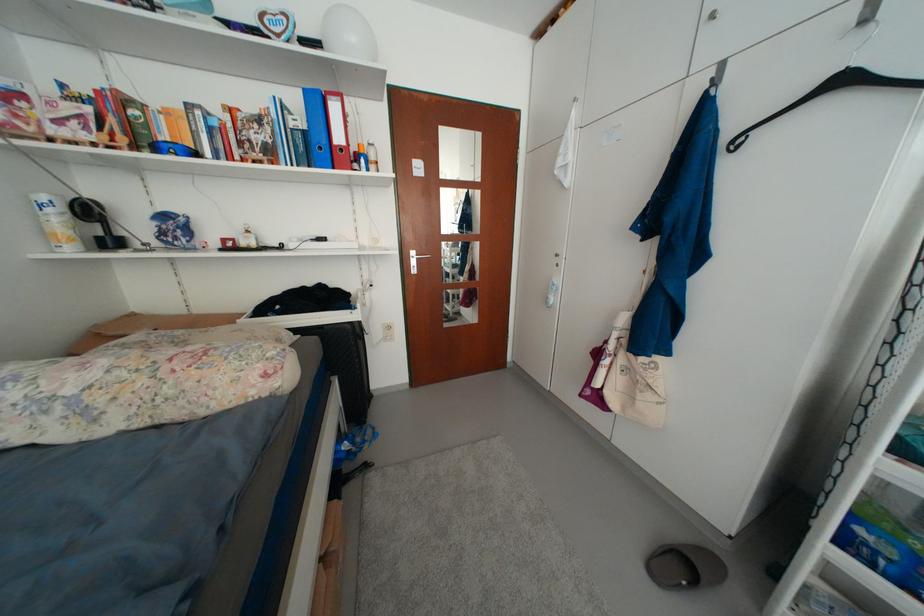
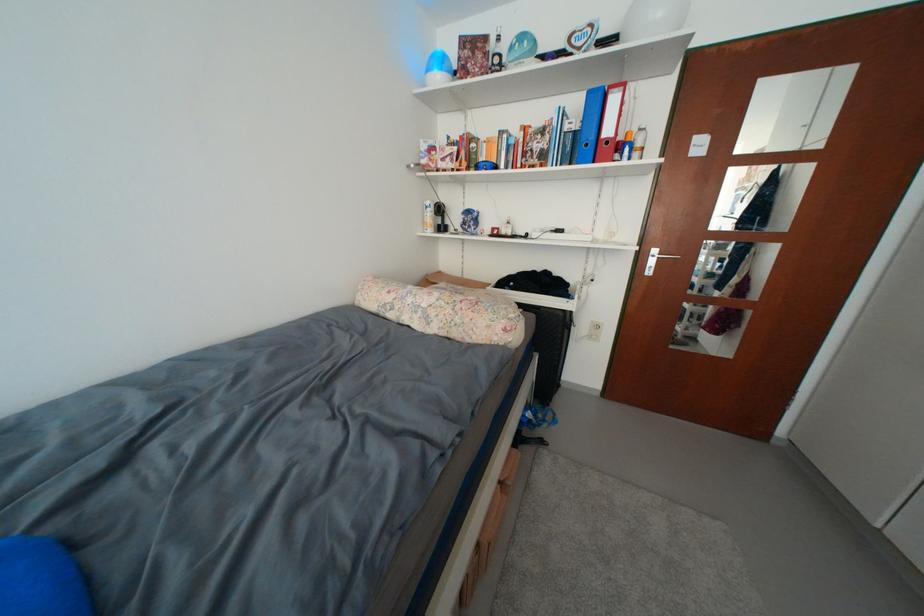
The point at [421,254] is marked in the first image. Where is the corresponding point in the second image?

(663, 254)